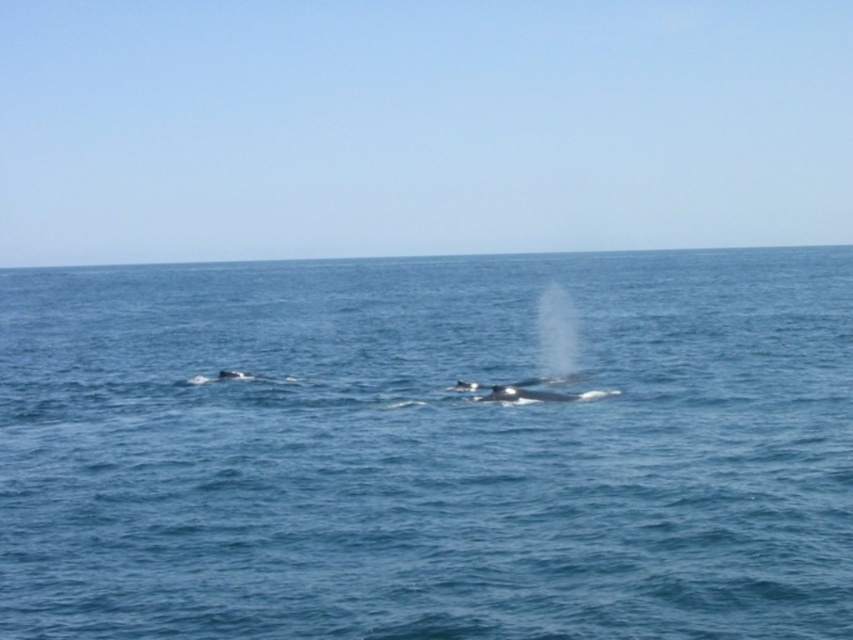
Question: Which object is the closest to the gray matte whale at left?

Choices:
 (A) blue water at center
 (B) gray smooth whale at center

Answer: (B)

Question: Where is gray smooth whale at center located in relation to gray matte whale at left in the image?

Choices:
 (A) right
 (B) left

Answer: (A)

Question: Which point is farther to the camera?

Choices:
 (A) (497, 396)
 (B) (274, 301)
 (C) (231, 372)

Answer: (B)

Question: Is gray smooth whale at center thinner than gray matte whale at left?

Choices:
 (A) no
 (B) yes

Answer: (A)

Question: Which is nearer to the gray smooth whale at center?

Choices:
 (A) blue water at center
 (B) gray matte whale at left

Answer: (B)

Question: Does blue water at center appear on the right side of gray smooth whale at center?

Choices:
 (A) yes
 (B) no

Answer: (B)